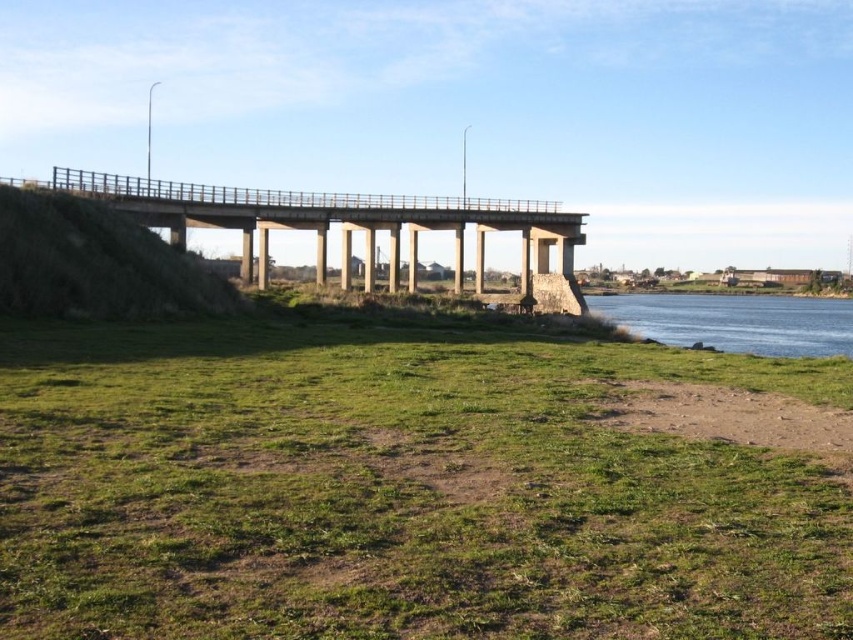
In the scene shown: Can you confirm if green grassy at lower center is smaller than concrete bridge at center?

Correct, green grassy at lower center occupies less space than concrete bridge at center.

Is point (495, 456) farther from camera compared to point (28, 180)?

That is False.

What do you see at coordinates (396, 488) in the screenshot?
I see `green grassy at lower center` at bounding box center [396, 488].

I want to click on green grassy at lower center, so click(x=396, y=488).

From the picture: Does green grassy at lower center have a lesser height compared to dirt ground at lower right?

In fact, green grassy at lower center may be taller than dirt ground at lower right.

Can you confirm if green grassy at lower center is positioned to the right of dirt ground at lower right?

→ Incorrect, green grassy at lower center is not on the right side of dirt ground at lower right.

Between point (271, 499) and point (784, 400), which one is positioned in front?

Point (271, 499)

Where is `green grassy at lower center`? green grassy at lower center is located at coordinates (396, 488).

Is the position of concrete bridge at center more distant than that of dirt ground at lower right?

Yes, concrete bridge at center is behind dirt ground at lower right.

Is point (286, 193) closer to viewer compared to point (842, 448)?

No, it is behind (842, 448).

At what (x,y) coordinates should I click in order to perform the action: click on concrete bridge at center. Please return your answer as a coordinate pair (x, y). The height and width of the screenshot is (640, 853). Looking at the image, I should click on (349, 227).